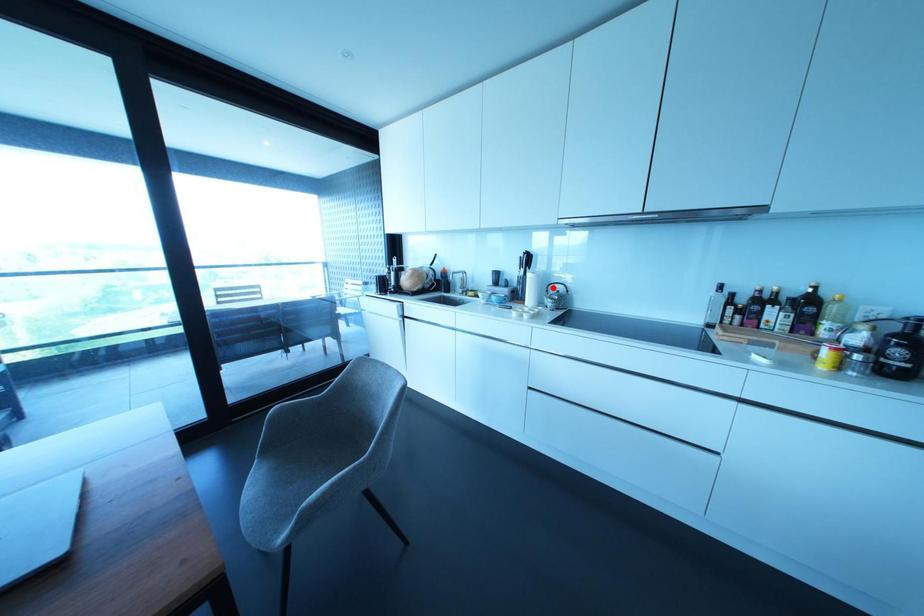
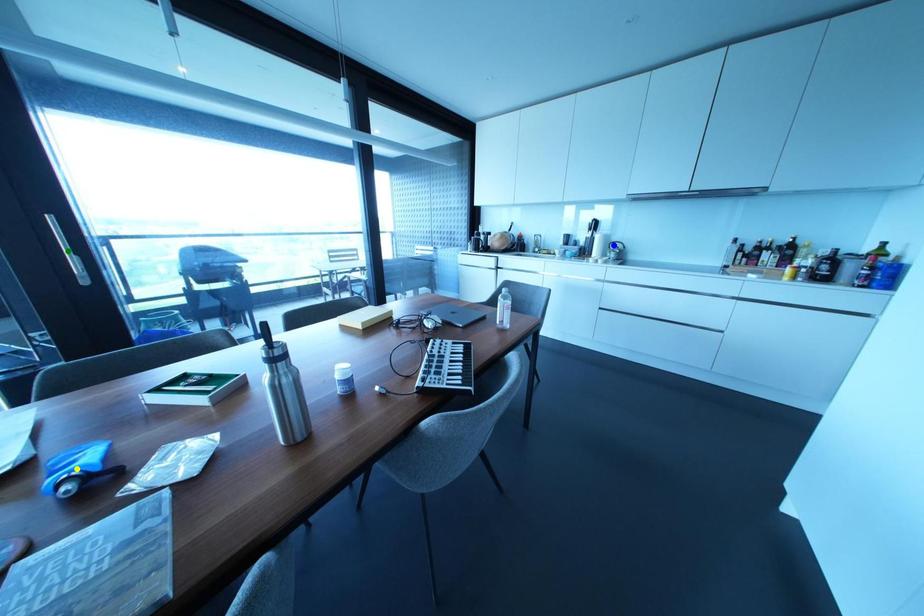
Question: I am providing you with two images of the same scene from different viewpoints. A red point is marked on the first image. You are given multiple points on the second image. Which spot in image 2 lines up with the point in image 1?

Choices:
 (A) green point
 (B) blue point
 (C) yellow point

Answer: (B)